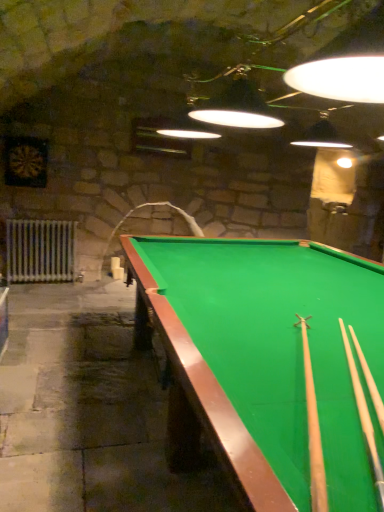
Where is `white metallic radiator at left`? The width and height of the screenshot is (384, 512). white metallic radiator at left is located at coordinates pyautogui.click(x=40, y=250).

You are a GUI agent. You are given a task and a screenshot of the screen. Output one action in this format:
    pyautogui.click(x=<x>, y=<y>)
    Task: Click on the light wood cue at right, which appears as the second cue when viewed from the left
    
    Given the screenshot: What is the action you would take?
    pyautogui.click(x=364, y=416)

Is green felt billiard table at center positioned with its back to light brown wood cue at center, which appears as the 1th cue when viewed from the left?

No, green felt billiard table at center is not facing the opposite direction of light brown wood cue at center, which appears as the 1th cue when viewed from the left.

Between green felt billiard table at center and light brown wood cue at center, the 2th cue viewed from the right, which one has larger width?

With larger width is green felt billiard table at center.

From a real-world perspective, is green felt billiard table at center on top of light brown wood cue at center, which appears as the 1th cue when viewed from the left?

No, from a real-world perspective, green felt billiard table at center is not above light brown wood cue at center, which appears as the 1th cue when viewed from the left.

From the picture: How different are the orientations of green felt billiard table at center and light brown wood cue at center, the 2th cue viewed from the right, in degrees?

62.5 degrees separate the facing orientations of green felt billiard table at center and light brown wood cue at center, the 2th cue viewed from the right.

In the scene shown: Is light brown wood cue at center, the 2th cue viewed from the right, wider or thinner than light wood cue at right, which appears as the 1th cue when viewed from the right?

Considering their sizes, light brown wood cue at center, the 2th cue viewed from the right, looks slimmer than light wood cue at right, which appears as the 1th cue when viewed from the right.

Is light brown wood cue at center, which appears as the 1th cue when viewed from the left, positioned far away from light wood cue at right, which appears as the second cue when viewed from the left?

No, light brown wood cue at center, which appears as the 1th cue when viewed from the left, is not far away from light wood cue at right, which appears as the second cue when viewed from the left.

Is light brown wood cue at center, the 2th cue viewed from the right, outside of light wood cue at right, which appears as the second cue when viewed from the left?

Yes, light brown wood cue at center, the 2th cue viewed from the right, is outside of light wood cue at right, which appears as the second cue when viewed from the left.

Where is `billiard table located above the white metallic radiator at left (from a real-world perspective)`? billiard table located above the white metallic radiator at left (from a real-world perspective) is located at coordinates (272, 358).

From the image's perspective, which is below, green felt billiard table at center or white metallic radiator at left?

green felt billiard table at center, from the image's perspective.

Between green felt billiard table at center and white metallic radiator at left, which one has less height?

white metallic radiator at left.

Is green felt billiard table at center beside white metallic radiator at left?

No, green felt billiard table at center is not in contact with white metallic radiator at left.

Considering the positions of point (373, 440) and point (57, 222), is point (373, 440) closer or farther from the camera than point (57, 222)?

Point (373, 440).

From the white metallic radiator at left, count 1st cues forward and point to it. Please provide its 2D coordinates.

[(364, 416)]

Considering the relative positions of light wood cue at right, which appears as the 1th cue when viewed from the right, and white metallic radiator at left in the image provided, is light wood cue at right, which appears as the 1th cue when viewed from the right, to the right of white metallic radiator at left from the viewer's perspective?

Indeed, light wood cue at right, which appears as the 1th cue when viewed from the right, is positioned on the right side of white metallic radiator at left.

From the image's perspective, relative to white metallic radiator at left, is light wood cue at right, which appears as the 1th cue when viewed from the right, above or below?

Clearly, from the image's perspective, light wood cue at right, which appears as the 1th cue when viewed from the right, is below white metallic radiator at left.

Where is `cue that is the 1st one above the green felt billiard table at center (from a real-world perspective)`? This screenshot has height=512, width=384. cue that is the 1st one above the green felt billiard table at center (from a real-world perspective) is located at coordinates (364, 416).

Considering the relative sizes of green felt billiard table at center and light wood cue at right, which appears as the 1th cue when viewed from the right, in the image provided, is green felt billiard table at center shorter than light wood cue at right, which appears as the 1th cue when viewed from the right,?

No, green felt billiard table at center is not shorter than light wood cue at right, which appears as the 1th cue when viewed from the right.

From the image's perspective, is green felt billiard table at center positioned above or below light wood cue at right, which appears as the second cue when viewed from the left?

green felt billiard table at center is below light wood cue at right, which appears as the second cue when viewed from the left.

Who is smaller, green felt billiard table at center or light wood cue at right, which appears as the 1th cue when viewed from the right?

With smaller size is light wood cue at right, which appears as the 1th cue when viewed from the right.

From the image's perspective, is light wood cue at right, which appears as the second cue when viewed from the left, above or below light brown wood cue at center, which appears as the 1th cue when viewed from the left?

light wood cue at right, which appears as the second cue when viewed from the left, is below light brown wood cue at center, which appears as the 1th cue when viewed from the left.

How many degrees apart are the facing directions of light wood cue at right, which appears as the second cue when viewed from the left, and light brown wood cue at center, which appears as the 1th cue when viewed from the left?

They differ by 2.21 degrees in their facing directions.

Considering the relative sizes of light wood cue at right, which appears as the 1th cue when viewed from the right, and light brown wood cue at center, the 2th cue viewed from the right, in the image provided, is light wood cue at right, which appears as the 1th cue when viewed from the right, wider than light brown wood cue at center, the 2th cue viewed from the right,?

Yes, light wood cue at right, which appears as the 1th cue when viewed from the right, is wider than light brown wood cue at center, the 2th cue viewed from the right.

Considering the positions of objects light wood cue at right, which appears as the second cue when viewed from the left, and light brown wood cue at center, the 2th cue viewed from the right, in the image provided, who is more to the right, light wood cue at right, which appears as the second cue when viewed from the left, or light brown wood cue at center, the 2th cue viewed from the right,?

light wood cue at right, which appears as the second cue when viewed from the left.

The image size is (384, 512). In the image, there is a white metallic radiator at left. Identify the location of billiard table below it (from the image's perspective). (272, 358).

From the image's perspective, between white metallic radiator at left and green felt billiard table at center, who is located below?

green felt billiard table at center.

Which object is further away from the camera, white metallic radiator at left or green felt billiard table at center?

white metallic radiator at left is more distant.

From the image's perspective, which cue is the 2nd one above the green felt billiard table at center? Please provide its 2D coordinates.

[(313, 429)]

You are a GUI agent. You are given a task and a screenshot of the screen. Output one action in this format:
    pyautogui.click(x=<x>, y=<y>)
    Task: Click on the cue above the light wood cue at right, which appears as the 1th cue when viewed from the right (from a real-world perspective)
    
    Given the screenshot: What is the action you would take?
    pyautogui.click(x=313, y=429)

Which object lies nearer to the anchor point light brown wood cue at center, the 2th cue viewed from the right, light wood cue at right, which appears as the second cue when viewed from the left, or white metallic radiator at left?

light wood cue at right, which appears as the second cue when viewed from the left.

Which object lies further to the anchor point white metallic radiator at left, light brown wood cue at center, the 2th cue viewed from the right, or light wood cue at right, which appears as the 1th cue when viewed from the right?

light wood cue at right, which appears as the 1th cue when viewed from the right, lies further to white metallic radiator at left than the other object.

Which object lies nearer to the anchor point light wood cue at right, which appears as the 1th cue when viewed from the right, light brown wood cue at center, which appears as the 1th cue when viewed from the left, or green felt billiard table at center?

light brown wood cue at center, which appears as the 1th cue when viewed from the left, is closer to light wood cue at right, which appears as the 1th cue when viewed from the right.

When comparing their distances from light brown wood cue at center, which appears as the 1th cue when viewed from the left, does white metallic radiator at left or green felt billiard table at center seem closer?

The object closer to light brown wood cue at center, which appears as the 1th cue when viewed from the left, is green felt billiard table at center.

Based on their spatial positions, is light brown wood cue at center, which appears as the 1th cue when viewed from the left, or white metallic radiator at left closer to light wood cue at right, which appears as the 1th cue when viewed from the right?

light brown wood cue at center, which appears as the 1th cue when viewed from the left.

Considering their positions, is white metallic radiator at left positioned closer to green felt billiard table at center than light wood cue at right, which appears as the second cue when viewed from the left?

light wood cue at right, which appears as the second cue when viewed from the left.

Based on the photo, from the image, which object appears to be nearer to light wood cue at right, which appears as the 1th cue when viewed from the right, white metallic radiator at left or light brown wood cue at center, which appears as the 1th cue when viewed from the left?

light brown wood cue at center, which appears as the 1th cue when viewed from the left, is positioned closer to the anchor light wood cue at right, which appears as the 1th cue when viewed from the right.

Based on their spatial positions, is green felt billiard table at center or light brown wood cue at center, which appears as the 1th cue when viewed from the left, further from light wood cue at right, which appears as the second cue when viewed from the left?

green felt billiard table at center is further to light wood cue at right, which appears as the second cue when viewed from the left.

This screenshot has width=384, height=512. What are the coordinates of `cue located between green felt billiard table at center and white metallic radiator at left in the depth direction` in the screenshot? It's located at (364, 416).

Where is `cue between light brown wood cue at center, the 2th cue viewed from the right, and green felt billiard table at center, in the horizontal direction`? cue between light brown wood cue at center, the 2th cue viewed from the right, and green felt billiard table at center, in the horizontal direction is located at coordinates (364, 416).

Where is `cue positioned between light brown wood cue at center, the 2th cue viewed from the right, and white metallic radiator at left from near to far`? cue positioned between light brown wood cue at center, the 2th cue viewed from the right, and white metallic radiator at left from near to far is located at coordinates (364, 416).

This screenshot has height=512, width=384. In order to click on billiard table positioned between light brown wood cue at center, which appears as the 1th cue when viewed from the left, and white metallic radiator at left from near to far in this screenshot , I will do `click(272, 358)`.